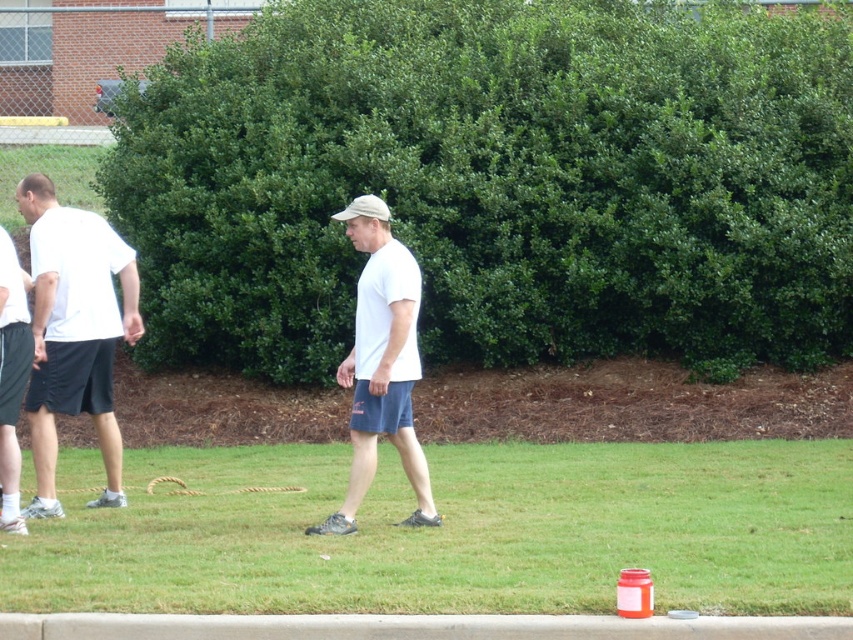
Based on the scene description, where is the green leafy bush at center located in terms of coordinates?

The green leafy bush at center is located at point coordinates of (498, 182).

You are a photographer trying to capture a group photo of the three individuals on the grassy field. Given that the green leafy bush at center is blocking part of the background, will the white matte baseball hat at center be more visible than the bush in the photo?

The green leafy bush at center is bigger than the white matte baseball hat at center, so the bush will likely block more of the background, making the hat less visible compared to the bush.